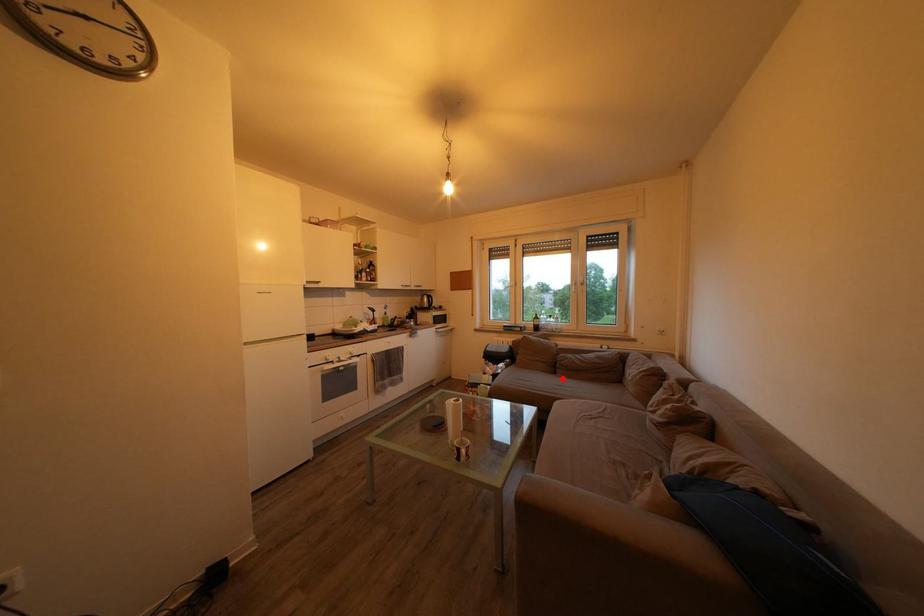
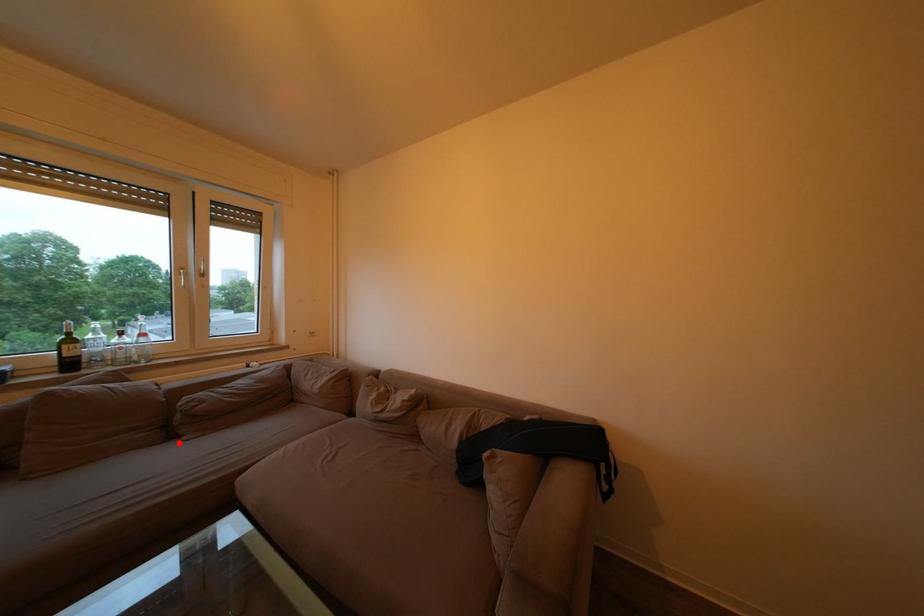
I am providing you with two images of the same scene from different viewpoints. A red point is marked on the first image and another point is marked on the second image. Does the point marked in image1 correspond to the same location as the one in image2?

Yes